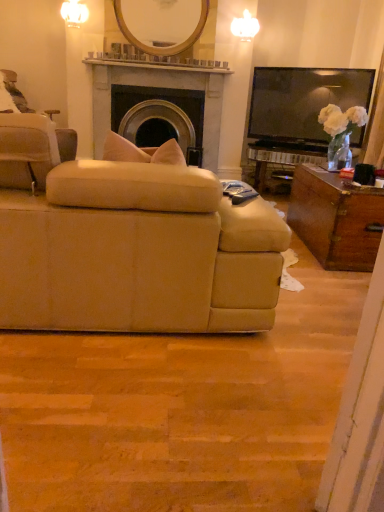
Question: From a real-world perspective, is matte stone fireplace at center located higher than beige fabric couch at center?

Choices:
 (A) no
 (B) yes

Answer: (B)

Question: From the image's perspective, would you say matte stone fireplace at center is positioned over beige fabric couch at center?

Choices:
 (A) no
 (B) yes

Answer: (B)

Question: Is matte stone fireplace at center at the left side of beige fabric couch at center?

Choices:
 (A) yes
 (B) no

Answer: (B)

Question: Would you say matte stone fireplace at center contains beige fabric couch at center?

Choices:
 (A) no
 (B) yes

Answer: (A)

Question: Can you confirm if matte stone fireplace at center is thinner than beige fabric couch at center?

Choices:
 (A) yes
 (B) no

Answer: (A)

Question: From the image's perspective, does matte stone fireplace at center appear lower than beige fabric couch at center?

Choices:
 (A) yes
 (B) no

Answer: (B)

Question: Is beige fabric chair at left wider than black plastic remote control at center?

Choices:
 (A) yes
 (B) no

Answer: (A)

Question: Is beige fabric chair at left positioned behind black plastic remote control at center?

Choices:
 (A) no
 (B) yes

Answer: (B)

Question: Is beige fabric chair at left oriented away from black plastic remote control at center?

Choices:
 (A) yes
 (B) no

Answer: (B)

Question: From the image's perspective, is beige fabric chair at left under black plastic remote control at center?

Choices:
 (A) no
 (B) yes

Answer: (A)

Question: Is beige fabric chair at left at the right side of black plastic remote control at center?

Choices:
 (A) yes
 (B) no

Answer: (B)

Question: Considering the relative sizes of beige fabric chair at left and black plastic remote control at center in the image provided, is beige fabric chair at left smaller than black plastic remote control at center?

Choices:
 (A) yes
 (B) no

Answer: (B)

Question: Could you tell me if beige fabric chair at left is facing wooden/matte mirror at upper center?

Choices:
 (A) yes
 (B) no

Answer: (B)